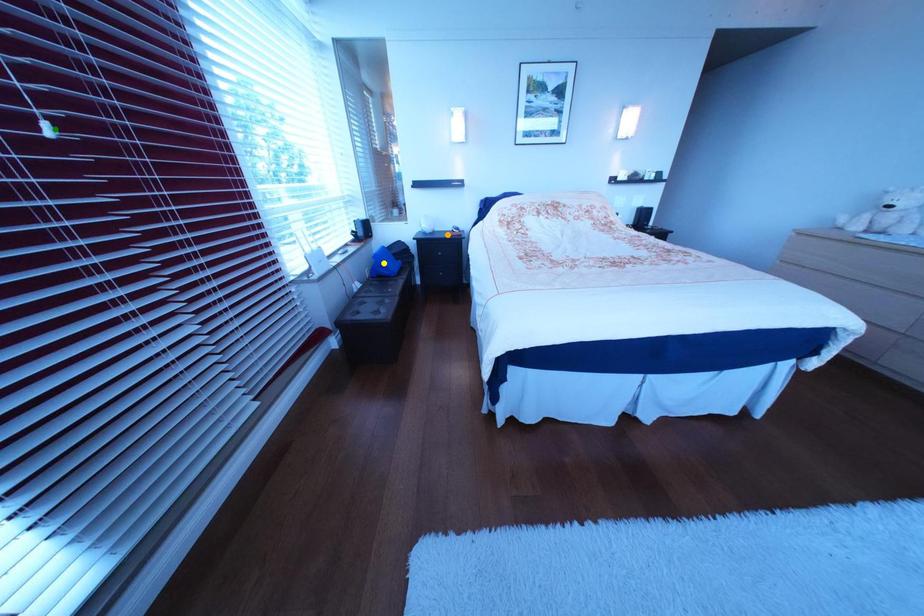
Order these from nearest to farthest:
yellow point
green point
orange point

green point < yellow point < orange point